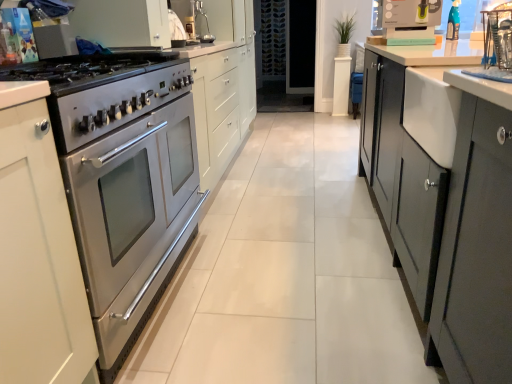
Question: Is matte yellow kettle at upper right positioned behind matte silver sink at upper center?

Choices:
 (A) yes
 (B) no

Answer: (B)

Question: Does matte yellow kettle at upper right appear on the right side of matte silver sink at upper center?

Choices:
 (A) yes
 (B) no

Answer: (A)

Question: From the image's perspective, does matte yellow kettle at upper right appear lower than matte silver sink at upper center?

Choices:
 (A) yes
 (B) no

Answer: (A)

Question: Can you confirm if matte yellow kettle at upper right is positioned to the left of matte silver sink at upper center?

Choices:
 (A) yes
 (B) no

Answer: (B)

Question: Is matte yellow kettle at upper right not close to matte silver sink at upper center?

Choices:
 (A) no
 (B) yes

Answer: (B)

Question: Is satin silver gas stove at left to the left or to the right of matte yellow kettle at upper right in the image?

Choices:
 (A) right
 (B) left

Answer: (B)

Question: From a real-world perspective, is satin silver gas stove at left above or below matte yellow kettle at upper right?

Choices:
 (A) below
 (B) above

Answer: (A)

Question: Relative to matte yellow kettle at upper right, is satin silver gas stove at left in front or behind?

Choices:
 (A) behind
 (B) front

Answer: (B)

Question: From the image's perspective, relative to matte yellow kettle at upper right, is satin silver gas stove at left above or below?

Choices:
 (A) below
 (B) above

Answer: (A)

Question: In the image, is matte silver sink at upper center positioned in front of or behind matte yellow kettle at upper right?

Choices:
 (A) front
 (B) behind

Answer: (B)

Question: From the image's perspective, is matte silver sink at upper center located above or below matte yellow kettle at upper right?

Choices:
 (A) above
 (B) below

Answer: (A)

Question: Considering the positions of point (187, 18) and point (428, 29), is point (187, 18) closer or farther from the camera than point (428, 29)?

Choices:
 (A) farther
 (B) closer

Answer: (A)

Question: Is matte silver sink at upper center to the left or to the right of matte yellow kettle at upper right in the image?

Choices:
 (A) left
 (B) right

Answer: (A)

Question: Is point (180, 104) closer or farther from the camera than point (274, 59)?

Choices:
 (A) farther
 (B) closer

Answer: (B)

Question: From a real-world perspective, is stainless steel oven at left above or below transparent glass door at center?

Choices:
 (A) above
 (B) below

Answer: (B)